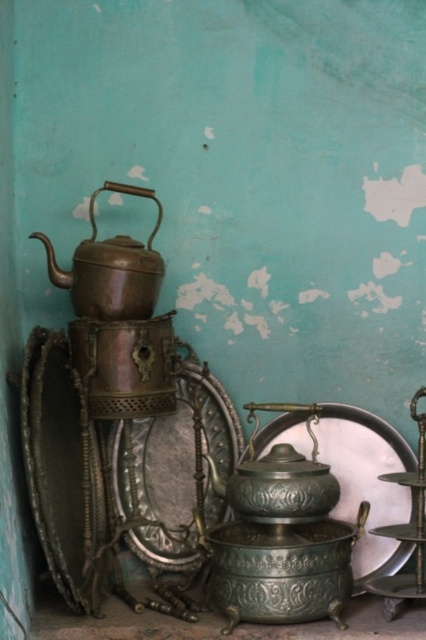
Question: Is polished silver plate at center above polished bronze teapot at center?

Choices:
 (A) yes
 (B) no

Answer: (A)

Question: Which point is closer to the camera?

Choices:
 (A) (118, 436)
 (B) (305, 513)
 (C) (152, 275)
 (D) (336, 470)

Answer: (B)

Question: Is polished silver plate at center thinner than bronze metallic teapot at upper left?

Choices:
 (A) yes
 (B) no

Answer: (B)

Question: Which of the following is the farthest from the observer?

Choices:
 (A) polished silver plate at center
 (B) green patina plate at center
 (C) polished bronze teapot at center
 (D) bronze metallic teapot at upper left

Answer: (A)

Question: Is green patina plate at center further to the viewer compared to polished bronze teapot at center?

Choices:
 (A) no
 (B) yes

Answer: (B)

Question: Estimate the real-world distances between objects in this image. Which object is closer to the polished silver plate at center?

Choices:
 (A) green patina plate at center
 (B) bronze metallic teapot at upper left
 (C) polished bronze teapot at center

Answer: (A)